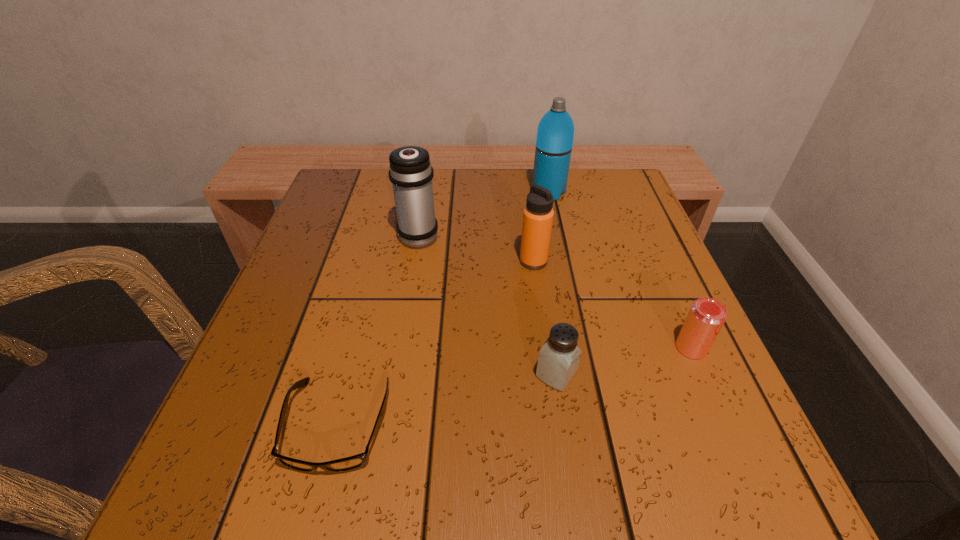
You are a GUI agent. You are given a task and a screenshot of the screen. Output one action in this format:
    pyautogui.click(x=<x>, y=<y>)
    Task: Click on the vacant space at the near edge
    This screenshot has width=960, height=540.
    Given the screenshot: What is the action you would take?
    (470, 499)

You are a GUI agent. You are given a task and a screenshot of the screen. Output one action in this format:
    pyautogui.click(x=<x>, y=<y>)
    Task: Click on the vacant region at the left edge
    The image size is (960, 540).
    Given the screenshot: What is the action you would take?
    pyautogui.click(x=285, y=337)

Identify the location of vacant space at the right edge of the desktop. Image resolution: width=960 pixels, height=540 pixels. (607, 240).

Where is `vacant area at the far left corner of the desktop`? The height and width of the screenshot is (540, 960). vacant area at the far left corner of the desktop is located at coordinates (371, 201).

I want to click on vacant region at the near left corner of the desktop, so click(x=213, y=467).

This screenshot has width=960, height=540. In the image, there is a desktop. In order to click on free space at the far right corner in this screenshot , I will do `click(598, 221)`.

I want to click on vacant area at the near right corner of the desktop, so click(717, 488).

You are a GUI agent. You are given a task and a screenshot of the screen. Output one action in this format:
    pyautogui.click(x=<x>, y=<y>)
    Task: Click on the free area in between the spectacles and the leftmost thermos bottle
    
    Given the screenshot: What is the action you would take?
    pyautogui.click(x=378, y=330)

I want to click on free space between the farthest thermos bottle and the spectacles, so click(x=444, y=308).

The image size is (960, 540). What are the coordinates of `vacant region between the shortest object and the saltshaker` in the screenshot? It's located at (447, 399).